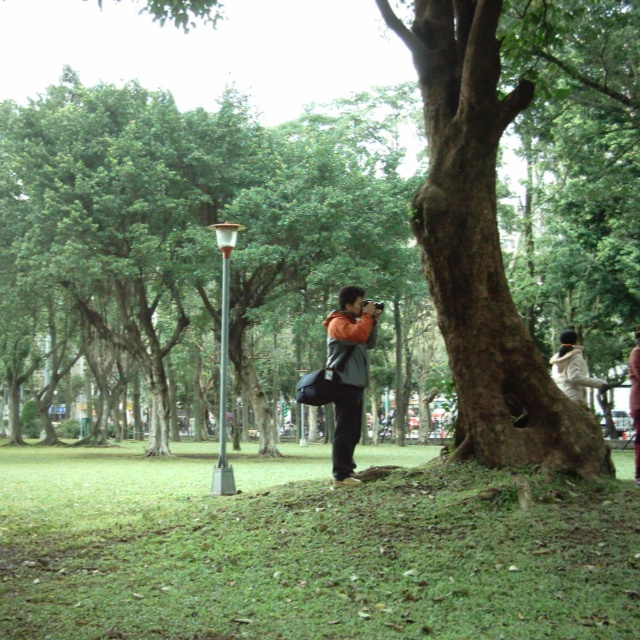
Question: Where is orange matte jacket at center located in relation to white fleece jacket at lower right in the image?

Choices:
 (A) left
 (B) right

Answer: (A)

Question: Can you confirm if metallic pole at center is bigger than orange fabric jacket at center?

Choices:
 (A) yes
 (B) no

Answer: (B)

Question: Which of the following is the farthest from the observer?

Choices:
 (A) (636, 456)
 (B) (596, 385)
 (C) (352, 291)

Answer: (B)

Question: Which point is farther to the camera?

Choices:
 (A) orange fabric jacket at center
 (B) metallic pole at center
 (C) white fleece jacket at lower right
 (D) orange matte jacket at center

Answer: (B)

Question: Observing the image, what is the correct spatial positioning of white fleece jacket at lower right in reference to orange fabric jacket at center?

Choices:
 (A) below
 (B) above

Answer: (B)

Question: Which is nearer to the orange fabric jacket at center?

Choices:
 (A) white fleece jacket at lower right
 (B) metallic pole at center
 (C) orange matte jacket at center

Answer: (A)